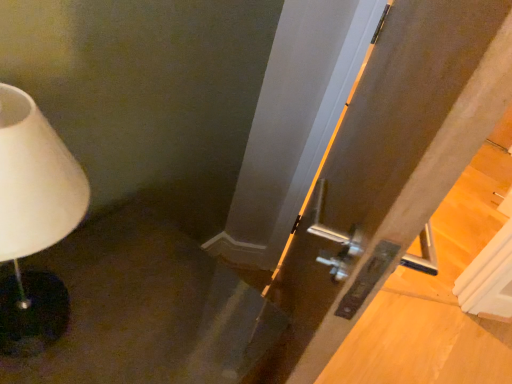
At what (x,y) coordinates should I click in order to perform the action: click on white matte lamp at left. Please return your answer as a coordinate pair (x, y). Looking at the image, I should click on (34, 221).

Describe the element at coordinates (34, 221) in the screenshot. Image resolution: width=512 pixels, height=384 pixels. I see `white matte lamp at left` at that location.

What do you see at coordinates (389, 168) in the screenshot? I see `metallic silver door at center` at bounding box center [389, 168].

You are a GUI agent. You are given a task and a screenshot of the screen. Output one action in this format:
    pyautogui.click(x=<x>, y=<y>)
    Task: Click on the metallic silver door at center
    
    Given the screenshot: What is the action you would take?
    pyautogui.click(x=389, y=168)

The height and width of the screenshot is (384, 512). What are the coordinates of `white matte lamp at left` in the screenshot? It's located at (34, 221).

Which object is positioned more to the left, metallic silver door at center or white matte lamp at left?

white matte lamp at left.

Is metallic silver door at center further to camera compared to white matte lamp at left?

No, it is in front of white matte lamp at left.

Based on the photo, which point is more forward, [435,60] or [55,168]?

The point [435,60] is more forward.

From the image's perspective, is metallic silver door at center on top of white matte lamp at left?

No.

From a real-world perspective, between metallic silver door at center and white matte lamp at left, who is vertically higher?

white matte lamp at left is physically above.

Considering the relative sizes of metallic silver door at center and white matte lamp at left in the image provided, is metallic silver door at center wider than white matte lamp at left?

Incorrect, the width of metallic silver door at center does not surpass that of white matte lamp at left.

Considering the sizes of objects metallic silver door at center and white matte lamp at left in the image provided, who is taller, metallic silver door at center or white matte lamp at left?

Standing taller between the two is metallic silver door at center.

Considering the relative sizes of metallic silver door at center and white matte lamp at left in the image provided, is metallic silver door at center smaller than white matte lamp at left?

No, metallic silver door at center is not smaller than white matte lamp at left.

Would you say metallic silver door at center is inside or outside white matte lamp at left?

metallic silver door at center is spatially situated outside white matte lamp at left.

Is metallic silver door at center far from white matte lamp at left?

That's not correct — metallic silver door at center is a little close to white matte lamp at left.

Is white matte lamp at left at the back of metallic silver door at center?

Yes, metallic silver door at center is facing away from white matte lamp at left.

What's the angular difference between metallic silver door at center and white matte lamp at left's facing directions?

The facing directions of metallic silver door at center and white matte lamp at left are 26.4 degrees apart.

Identify the location of door below the white matte lamp at left (from a real-world perspective). This screenshot has width=512, height=384. (389, 168).

From the picture: Does white matte lamp at left appear on the left side of metallic silver door at center?

Correct, you'll find white matte lamp at left to the left of metallic silver door at center.

Is white matte lamp at left behind metallic silver door at center?

Yes.

Which point is more distant from viewer, (58,307) or (307,207)?

The point (307,207) is farther.

From the image's perspective, which is below, white matte lamp at left or metallic silver door at center?

metallic silver door at center.

From a real-world perspective, relative to metallic silver door at center, is white matte lamp at left vertically above or below?

In terms of real-world spatial position, white matte lamp at left is above metallic silver door at center.

Does white matte lamp at left have a greater width compared to metallic silver door at center?

Correct, the width of white matte lamp at left exceeds that of metallic silver door at center.

Is white matte lamp at left taller than metallic silver door at center?

Incorrect, the height of white matte lamp at left is not larger of that of metallic silver door at center.

Which of these two, white matte lamp at left or metallic silver door at center, is smaller?

white matte lamp at left is smaller.

Is white matte lamp at left spatially inside metallic silver door at center, or outside of it?

white matte lamp at left is located beyond the bounds of metallic silver door at center.

Are white matte lamp at left and metallic silver door at center located far from each other?

white matte lamp at left is near metallic silver door at center, not far away.

Is white matte lamp at left facing towards metallic silver door at center?

No, white matte lamp at left is not aimed at metallic silver door at center.

Locate an element on the screen. The height and width of the screenshot is (384, 512). lamp behind the metallic silver door at center is located at coordinates (34, 221).

Where is `lamp behind the metallic silver door at center`? The width and height of the screenshot is (512, 384). lamp behind the metallic silver door at center is located at coordinates (34, 221).

This screenshot has width=512, height=384. In order to click on lamp above the metallic silver door at center (from a real-world perspective) in this screenshot , I will do `click(34, 221)`.